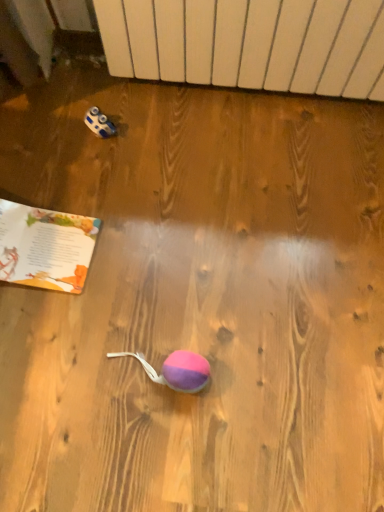
Question: Is paperback book at bottom left positioned with its back to white matte radiator at upper center?

Choices:
 (A) no
 (B) yes

Answer: (B)

Question: Is paperback book at bottom left oriented towards white matte radiator at upper center?

Choices:
 (A) yes
 (B) no

Answer: (B)

Question: Is paperback book at bottom left at the right side of white matte radiator at upper center?

Choices:
 (A) yes
 (B) no

Answer: (B)

Question: Does paperback book at bottom left have a smaller size compared to white matte radiator at upper center?

Choices:
 (A) yes
 (B) no

Answer: (A)

Question: Is paperback book at bottom left not within white matte radiator at upper center?

Choices:
 (A) yes
 (B) no

Answer: (A)

Question: Is paperback book at bottom left positioned before white matte radiator at upper center?

Choices:
 (A) no
 (B) yes

Answer: (A)

Question: Is white matte radiator at upper center to the right of paperback book at bottom left from the viewer's perspective?

Choices:
 (A) yes
 (B) no

Answer: (A)

Question: Is white matte radiator at upper center oriented towards paperback book at bottom left?

Choices:
 (A) no
 (B) yes

Answer: (B)

Question: Can you confirm if white matte radiator at upper center is smaller than paperback book at bottom left?

Choices:
 (A) no
 (B) yes

Answer: (A)

Question: Is white matte radiator at upper center to the left of paperback book at bottom left from the viewer's perspective?

Choices:
 (A) no
 (B) yes

Answer: (A)

Question: Is white matte radiator at upper center not inside paperback book at bottom left?

Choices:
 (A) no
 (B) yes

Answer: (B)

Question: From the image's perspective, is white matte radiator at upper center on paperback book at bottom left?

Choices:
 (A) no
 (B) yes

Answer: (B)

Question: Is point pyautogui.click(x=13, y=206) closer or farther from the camera than point pyautogui.click(x=135, y=33)?

Choices:
 (A) closer
 (B) farther

Answer: (B)